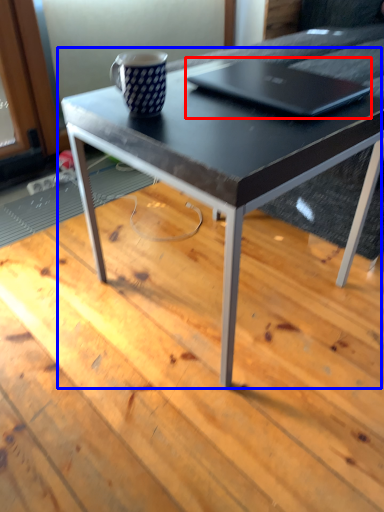
Question: Which object is closer to the camera taking this photo, laptop (highlighted by a red box) or coffee table (highlighted by a blue box)?

Choices:
 (A) laptop
 (B) coffee table

Answer: (B)